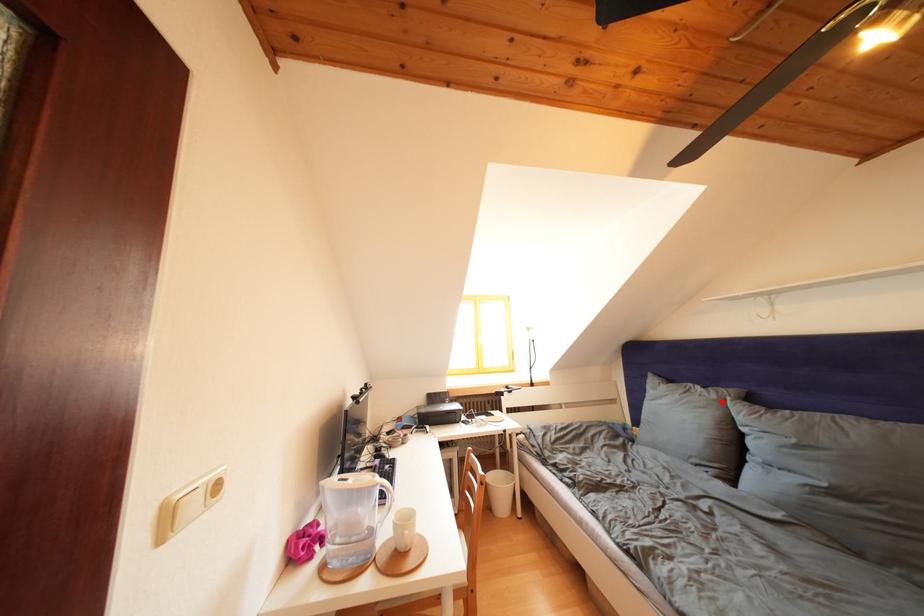
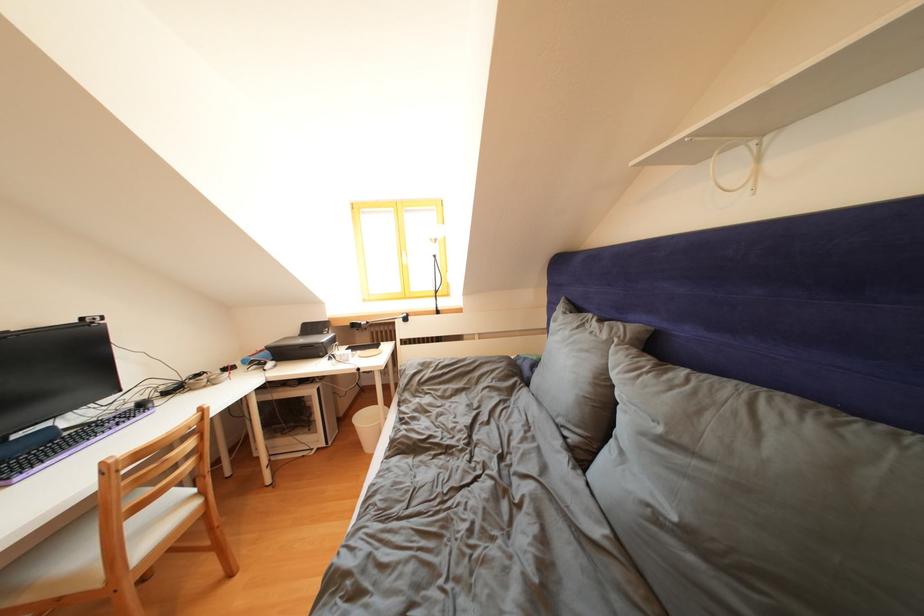
The point at the highlighted location is marked in the first image. Where is the corresponding point in the second image?

(612, 341)